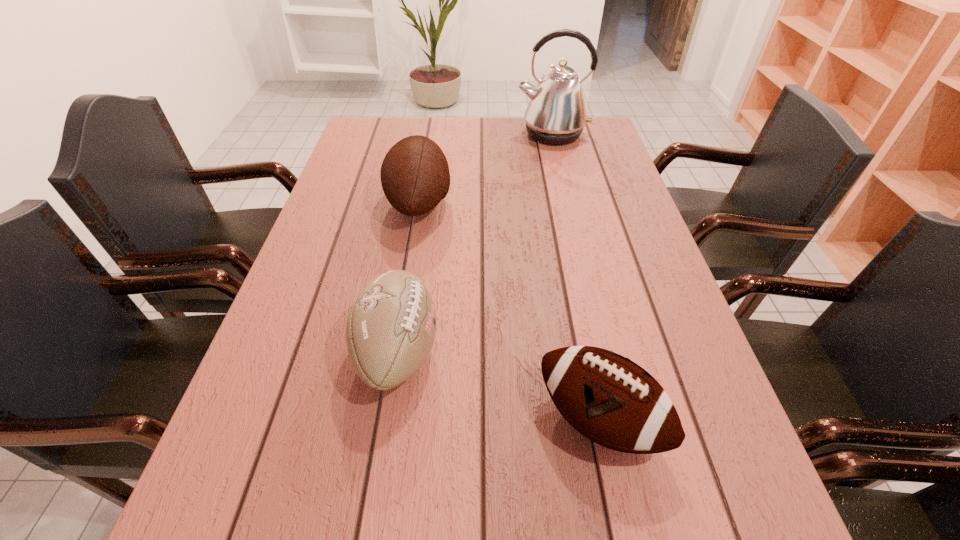
Image resolution: width=960 pixels, height=540 pixels. What are the coordinates of `kettle` in the screenshot? It's located at (556, 114).

Identify the location of the farthest object. The image size is (960, 540). (556, 114).

At what (x,y) coordinates should I click in order to perform the action: click on the third nearest object. Please return your answer as a coordinate pair (x, y). Looking at the image, I should click on [415, 177].

Identify the location of the rightmost football (American). [609, 399].

What are the coordinates of `free spot located 0.060m from the spout of the farthest object` in the screenshot? It's located at (558, 159).

Locate an element on the screen. This screenshot has width=960, height=540. free space located 0.210m on the laces of the second farthest object is located at coordinates pos(529,203).

Locate an element on the screen. free region located on the back of the rightmost football (American) is located at coordinates (564, 250).

Locate an element on the screen. object that is at the far edge is located at coordinates (556, 114).

At what (x,y) coordinates should I click in order to perform the action: click on kettle located in the right edge section of the desktop. Please return your answer as a coordinate pair (x, y). Looking at the image, I should click on (556, 114).

Where is `football (American) located in the right edge section of the desktop`? The height and width of the screenshot is (540, 960). football (American) located in the right edge section of the desktop is located at coordinates (609, 399).